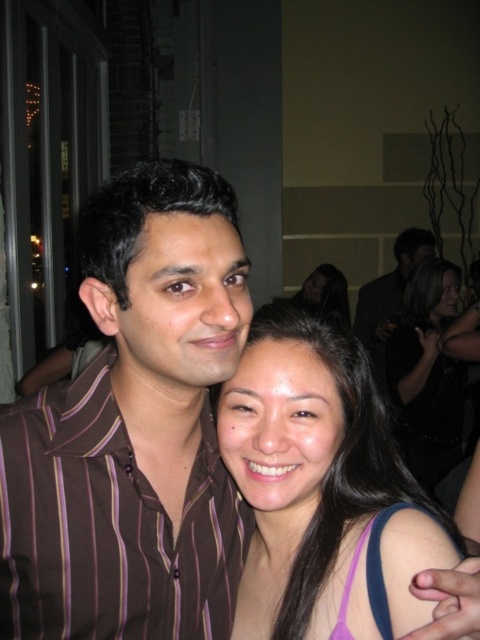
You are a photographer at an event and notice the black satin dress at lower right and the smooth black hair at upper right in the frame. Which object is located lower in the image?

The black satin dress at lower right is positioned under smooth black hair at upper right, so the black satin dress at lower right is located lower in the image.

You are a photographer trying to adjust the lighting for a photo. You notice two elements in the frame that might cast shadows. The dark brown striped shirt at center and the smooth black hair at upper right. Which one is positioned more to the right in the image?

The dark brown striped shirt at center is to the right of smooth black hair at upper right, so the dark brown striped shirt at center is positioned more to the right in the image.